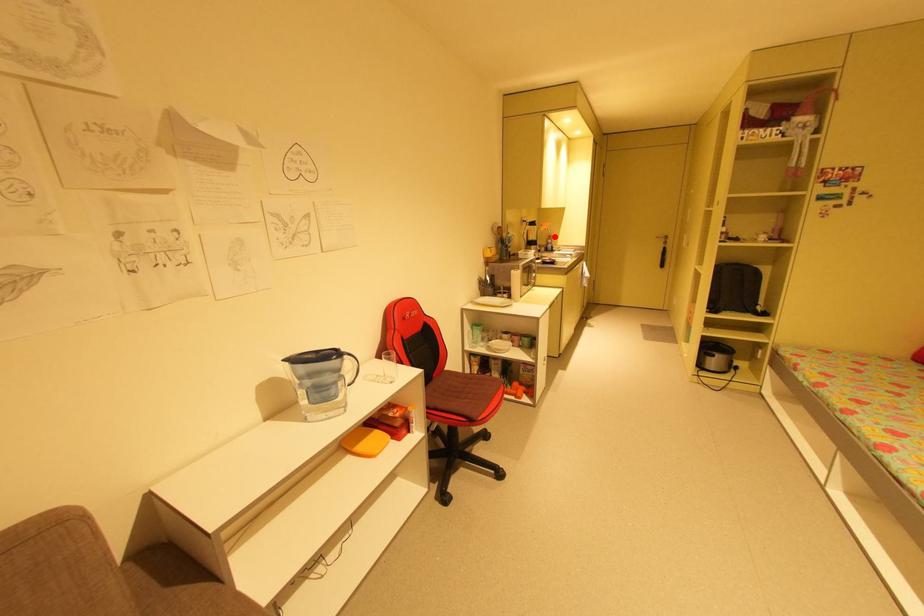
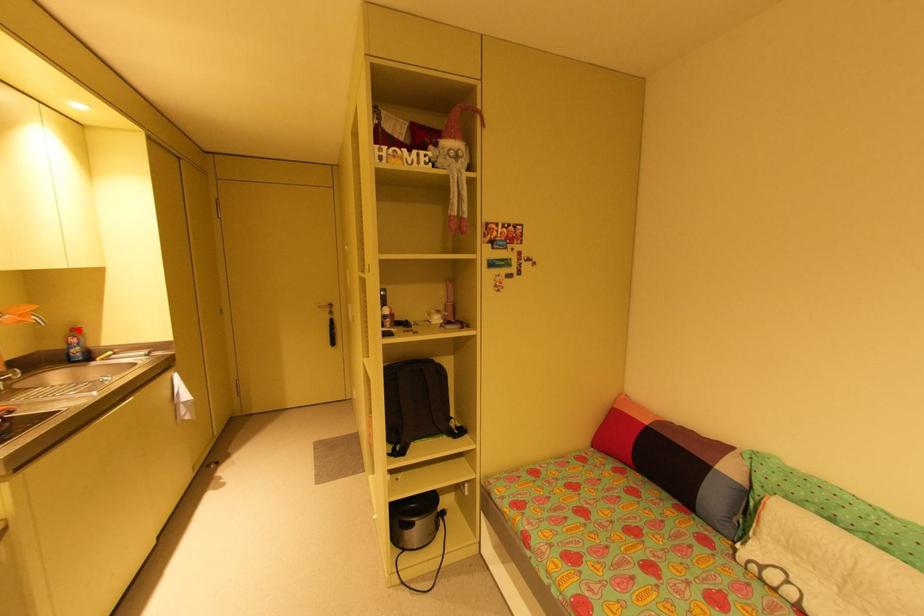
I am providing you with two images of the same scene from different viewpoints. A red point is marked on the first image and another point is marked on the second image. Is the red point in image1 aligned with the point shown in image2?

Yes